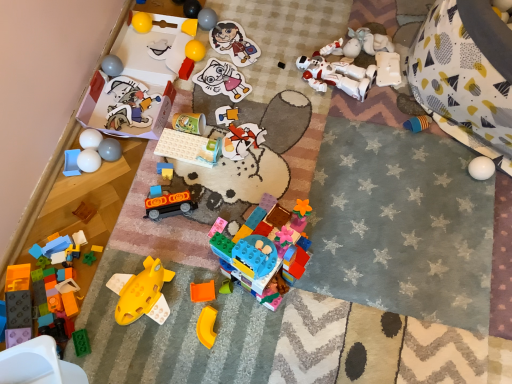
Where is `free space behind white glossy ball at left, the nineteenth toy in the right-to-left sequence`? free space behind white glossy ball at left, the nineteenth toy in the right-to-left sequence is located at coordinates (109, 120).